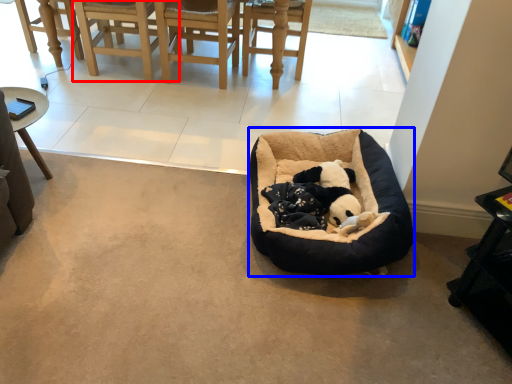
Question: Which object appears farthest to the camera in this image, chair (highlighted by a red box) or dog bed (highlighted by a blue box)?

Choices:
 (A) chair
 (B) dog bed

Answer: (A)